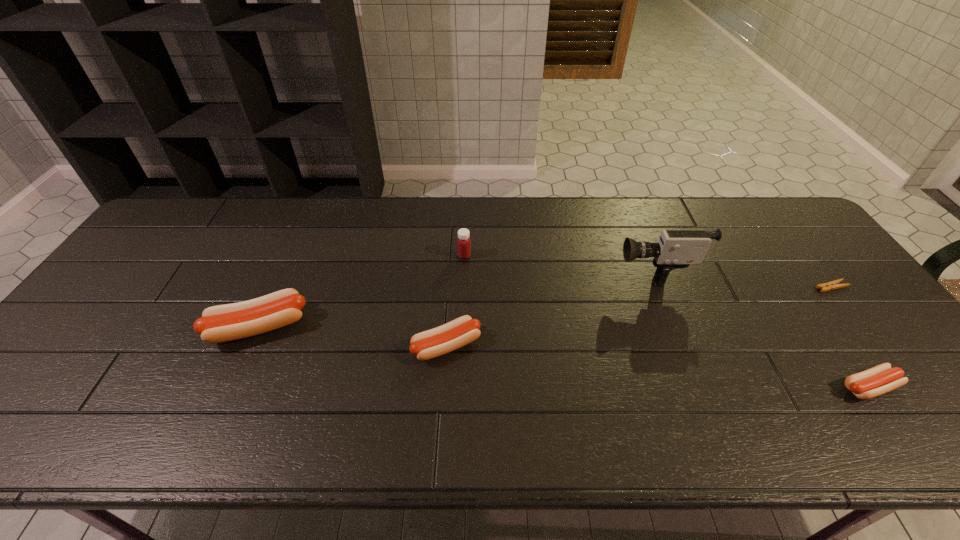
Locate an element on the screen. Image resolution: width=960 pixels, height=540 pixels. blank area located 0.310m on the right of the tallest sausage is located at coordinates (426, 327).

Identify the location of vacant space located on the back of the fourth tallest object. This screenshot has width=960, height=540. pos(454,239).

Identify the location of free space located on the left of the rightmost sausage. Image resolution: width=960 pixels, height=540 pixels. point(721,387).

I want to click on free region located on the front of the clothespin, so click(890, 363).

Where is `vacant space located 0.070m on the left of the second tallest object`? The image size is (960, 540). vacant space located 0.070m on the left of the second tallest object is located at coordinates (435, 255).

What are the coordinates of `vacant area located on the recording direction of the third object from right to left` in the screenshot? It's located at (565, 269).

In order to click on vacant space situated 0.310m on the recording direction of the third object from right to left in this screenshot , I will do `click(507, 269)`.

Locate an element on the screen. This screenshot has width=960, height=540. vacant space located 0.080m on the recording direction of the third object from right to left is located at coordinates (586, 269).

Identify the location of object that is at the near edge. pos(880,379).

At what (x,y) coordinates should I click in order to perform the action: click on sausage present at the right edge. Please return your answer as a coordinate pair (x, y). Image resolution: width=960 pixels, height=540 pixels. Looking at the image, I should click on (880, 379).